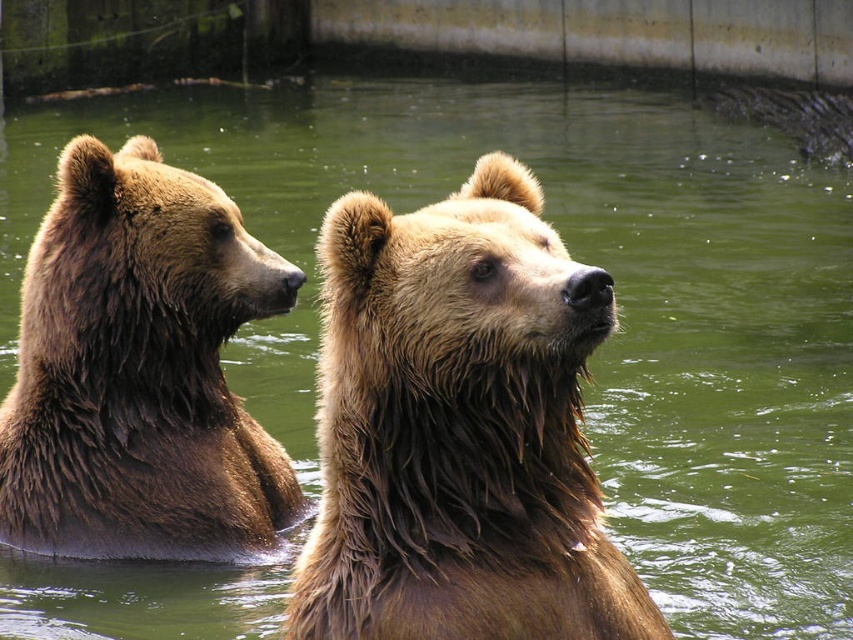
Question: Is wet fur bear at center behind shaggy brown bear at center?

Choices:
 (A) yes
 (B) no

Answer: (B)

Question: Which of the following is the farthest from the observer?

Choices:
 (A) (490, 262)
 (B) (231, 408)

Answer: (B)

Question: Can you confirm if wet fur bear at center is positioned above shaggy brown bear at center?

Choices:
 (A) no
 (B) yes

Answer: (A)

Question: Considering the relative positions of wet fur bear at center and shaggy brown bear at center in the image provided, where is wet fur bear at center located with respect to shaggy brown bear at center?

Choices:
 (A) right
 (B) left

Answer: (A)

Question: Which point is closer to the camera?

Choices:
 (A) (234, 458)
 (B) (451, 369)

Answer: (B)

Question: Which object is closer to the camera taking this photo?

Choices:
 (A) wet fur bear at center
 (B) shaggy brown bear at center

Answer: (A)